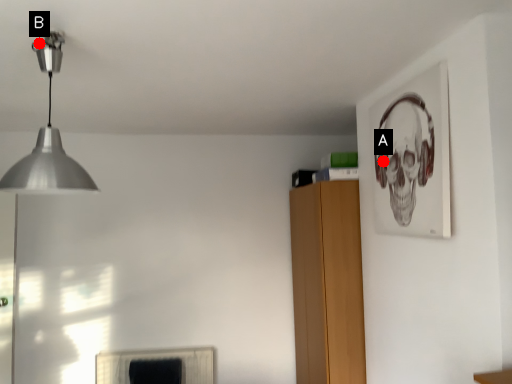
Question: Two points are circled on the image, labeled by A and B beside each circle. Which point is further to the camera?

Choices:
 (A) A is further
 (B) B is further

Answer: (A)